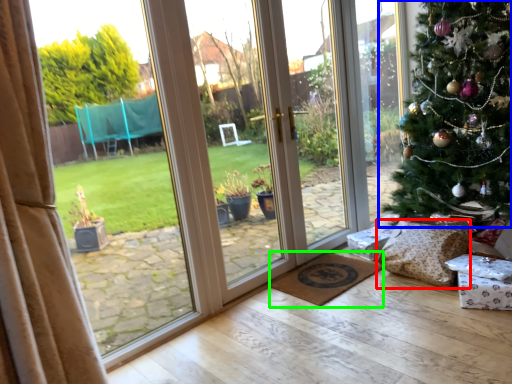
Question: Which is nearer to the pillow (highlighted by a red box)? christmas tree (highlighted by a blue box) or doormat (highlighted by a green box).

Choices:
 (A) christmas tree
 (B) doormat

Answer: (B)